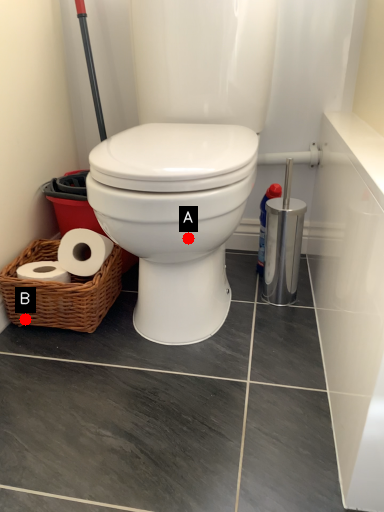
Question: Two points are circled on the image, labeled by A and B beside each circle. Which point is farther from the camera taking this photo?

Choices:
 (A) A is further
 (B) B is further

Answer: (B)